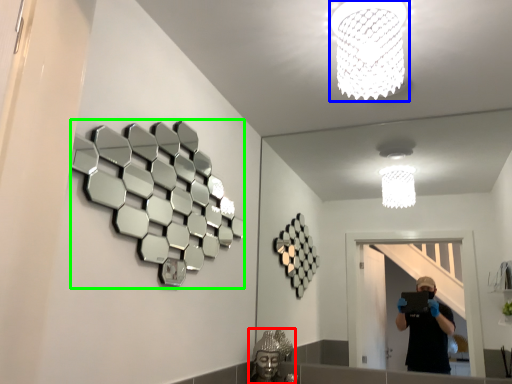
Question: Which object is the farthest from reflection (highlighted by a red box)? Choose among these: lamp (highlighted by a blue box) or mirror (highlighted by a green box).

Choices:
 (A) lamp
 (B) mirror

Answer: (A)